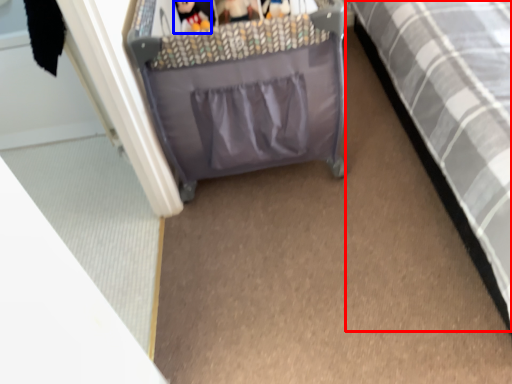
Question: Which object appears farthest to the camera in this image, furniture (highlighted by a red box) or toy (highlighted by a blue box)?

Choices:
 (A) furniture
 (B) toy

Answer: (B)